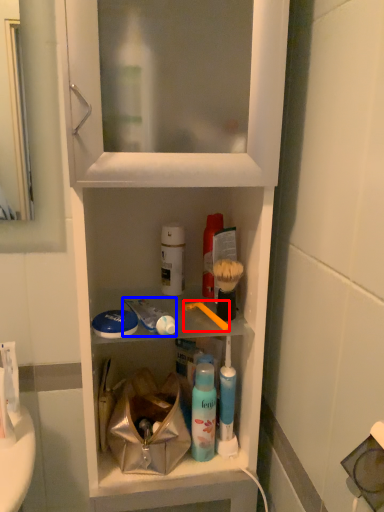
Question: Which point is closer to the camera, toothbrush (highlighted by a red box) or toothpaste (highlighted by a blue box)?

Choices:
 (A) toothbrush
 (B) toothpaste

Answer: (B)